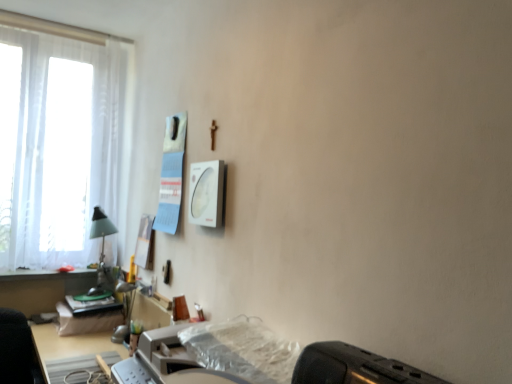
Question: Is translucent plastic printer at lower center at the back of black plastic toaster at lower right?

Choices:
 (A) yes
 (B) no

Answer: (B)

Question: Is black plastic toaster at lower right not near translucent plastic printer at lower center?

Choices:
 (A) yes
 (B) no

Answer: (B)

Question: Does black plastic toaster at lower right lie in front of translucent plastic printer at lower center?

Choices:
 (A) yes
 (B) no

Answer: (A)

Question: Is black plastic toaster at lower right bigger than translucent plastic printer at lower center?

Choices:
 (A) yes
 (B) no

Answer: (B)

Question: From a real-world perspective, is black plastic toaster at lower right under translucent plastic printer at lower center?

Choices:
 (A) no
 (B) yes

Answer: (A)

Question: Relative to white sheer curtain at left, is translucent plastic printer at lower center in front or behind?

Choices:
 (A) front
 (B) behind

Answer: (A)

Question: Would you say translucent plastic printer at lower center is to the left or to the right of white sheer curtain at left in the picture?

Choices:
 (A) left
 (B) right

Answer: (B)

Question: Do you think translucent plastic printer at lower center is within white sheer curtain at left, or outside of it?

Choices:
 (A) inside
 (B) outside

Answer: (B)

Question: From a real-world perspective, is translucent plastic printer at lower center positioned above or below white sheer curtain at left?

Choices:
 (A) below
 (B) above

Answer: (A)

Question: In terms of height, does translucent plastic printer at lower center look taller or shorter compared to transparent plastic sheet at lower center?

Choices:
 (A) tall
 (B) short

Answer: (A)

Question: Is translucent plastic printer at lower center in front of or behind transparent plastic sheet at lower center in the image?

Choices:
 (A) behind
 (B) front

Answer: (A)

Question: From a real-world perspective, is translucent plastic printer at lower center above or below transparent plastic sheet at lower center?

Choices:
 (A) above
 (B) below

Answer: (B)

Question: Choose the correct answer: Is translucent plastic printer at lower center inside transparent plastic sheet at lower center or outside it?

Choices:
 (A) outside
 (B) inside

Answer: (A)

Question: Is transparent plastic sheet at lower center taller or shorter than black plastic toaster at lower right?

Choices:
 (A) tall
 (B) short

Answer: (B)

Question: From the image's perspective, relative to black plastic toaster at lower right, is transparent plastic sheet at lower center above or below?

Choices:
 (A) below
 (B) above

Answer: (A)